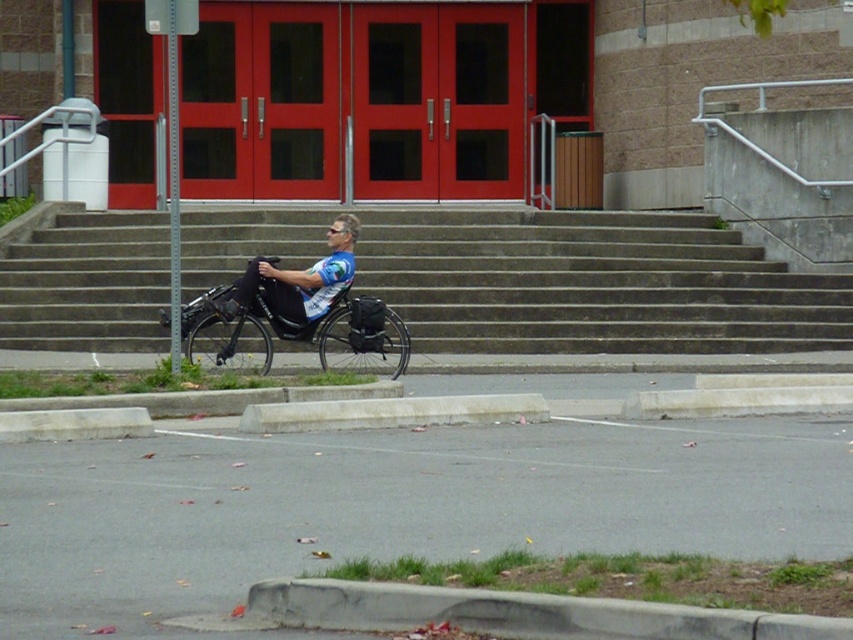
Question: Considering the relative positions of concrete stairs at center and black plastic wheelchair at center in the image provided, where is concrete stairs at center located with respect to black plastic wheelchair at center?

Choices:
 (A) left
 (B) right

Answer: (B)

Question: Does concrete stairs at center appear over black plastic wheelchair at center?

Choices:
 (A) no
 (B) yes

Answer: (B)

Question: Is concrete stairs at center above black plastic wheelchair at center?

Choices:
 (A) no
 (B) yes

Answer: (B)

Question: Among these objects, which one is farthest from the camera?

Choices:
 (A) concrete stairs at center
 (B) black plastic wheelchair at center

Answer: (A)

Question: Among these objects, which one is farthest from the camera?

Choices:
 (A) black plastic wheelchair at center
 (B) concrete stairs at center

Answer: (B)